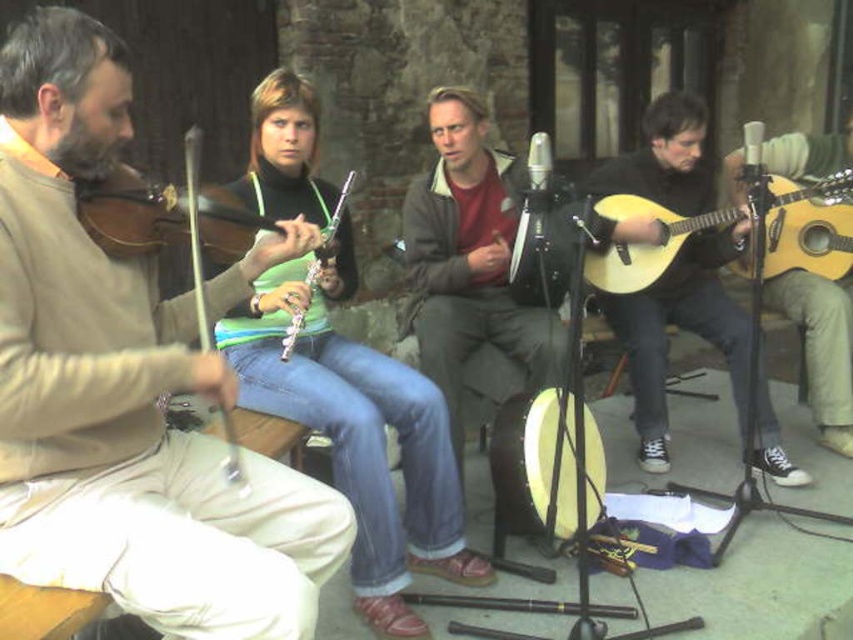
Is green fabric shirt at center behind light brown acoustic guitar at right?

No.

Which is behind, point (340, 374) or point (625, 269)?

The point (625, 269) is more distant.

You are a GUI agent. You are given a task and a screenshot of the screen. Output one action in this format:
    pyautogui.click(x=<x>, y=<y>)
    Task: Click on the green fabric shirt at center
    This screenshot has width=853, height=640.
    Given the screenshot: What is the action you would take?
    pyautogui.click(x=358, y=432)

Locate an element on the screen. The height and width of the screenshot is (640, 853). matte brown violin at left is located at coordinates (125, 387).

Does point (134, 387) lie behind point (119, 240)?

That is False.

Which is behind, point (28, 148) or point (140, 248)?

Point (140, 248)

I want to click on matte brown violin at left, so click(125, 387).

In the scene shown: Does matte brown violin at left have a greater width compared to dark gray fabric jacket at center?

Yes.

Which of these two, matte brown violin at left or dark gray fabric jacket at center, stands taller?

dark gray fabric jacket at center is taller.

Who is more distant from viewer, [200,566] or [463,92]?

Positioned behind is point [463,92].

You are a GUI agent. You are given a task and a screenshot of the screen. Output one action in this format:
    pyautogui.click(x=<x>, y=<y>)
    Task: Click on the matte brown violin at left
    
    Given the screenshot: What is the action you would take?
    pyautogui.click(x=125, y=387)